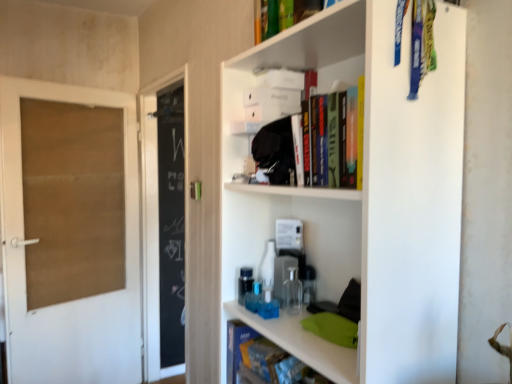
Question: From the image's perspective, is hardcover book at upper center, arranged as the first book when viewed from the top, over blue matte book at lower center, which ranks as the first book in bottom-to-top order?

Choices:
 (A) yes
 (B) no

Answer: (A)

Question: Can you confirm if hardcover book at upper center, positioned as the 2th book in back-to-front order, is smaller than blue matte book at lower center, which ranks as the first book in bottom-to-top order?

Choices:
 (A) no
 (B) yes

Answer: (A)

Question: Does hardcover book at upper center, arranged as the first book when viewed from the top, contain blue matte book at lower center, which is the 1th book in back-to-front order?

Choices:
 (A) no
 (B) yes

Answer: (A)

Question: Is hardcover book at upper center, arranged as the first book when viewed from the top, to the right of blue matte book at lower center, which is the 1th book in back-to-front order, from the viewer's perspective?

Choices:
 (A) no
 (B) yes

Answer: (B)

Question: Is hardcover book at upper center, positioned as the 2th book in back-to-front order, shorter than blue matte book at lower center, positioned as the 2th book in front-to-back order?

Choices:
 (A) yes
 (B) no

Answer: (B)

Question: From a real-world perspective, is hardcover book at upper center, which is the 1th book from front to back, beneath blue matte book at lower center, which ranks as the first book in bottom-to-top order?

Choices:
 (A) yes
 (B) no

Answer: (B)

Question: From the image's perspective, is brown cardboard door at left located above blue matte book at lower center, which ranks as the first book in bottom-to-top order?

Choices:
 (A) yes
 (B) no

Answer: (A)

Question: Does brown cardboard door at left contain blue matte book at lower center, positioned as the 2th book in front-to-back order?

Choices:
 (A) no
 (B) yes

Answer: (A)

Question: From a real-world perspective, is brown cardboard door at left physically above blue matte book at lower center, which ranks as the first book in bottom-to-top order?

Choices:
 (A) no
 (B) yes

Answer: (A)

Question: Is brown cardboard door at left oriented towards blue matte book at lower center, which is the second book from top to bottom?

Choices:
 (A) yes
 (B) no

Answer: (A)

Question: Is brown cardboard door at left touching blue matte book at lower center, which is the second book from top to bottom?

Choices:
 (A) no
 (B) yes

Answer: (A)

Question: Does brown cardboard door at left have a greater width compared to blue matte book at lower center, which ranks as the first book in bottom-to-top order?

Choices:
 (A) yes
 (B) no

Answer: (A)

Question: Can you confirm if white matte shelf at upper right is smaller than brown cardboard door at left?

Choices:
 (A) yes
 (B) no

Answer: (A)